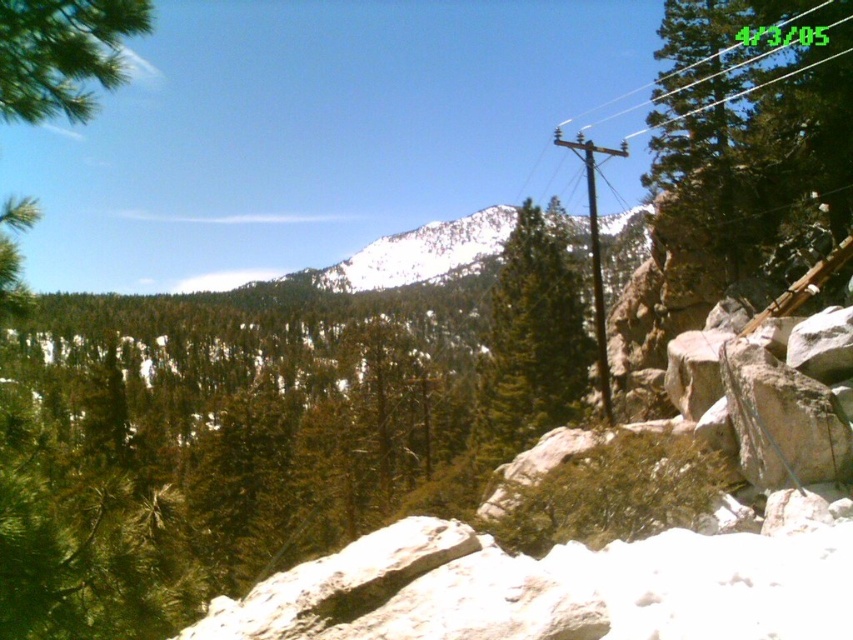
Question: Can you confirm if green textured pine tree at center is positioned below brown wooden telegraph pole at center-right?

Choices:
 (A) no
 (B) yes

Answer: (B)

Question: Does snowy white mountain at center appear on the right side of brown wooden telegraph pole at center-right?

Choices:
 (A) yes
 (B) no

Answer: (B)

Question: Which object is positioned closest to the green textured pine tree at center?

Choices:
 (A) brown wooden telegraph pole at center-right
 (B) black plastic power line at upper right

Answer: (A)

Question: Which object is positioned farthest from the brown wooden telegraph pole at center-right?

Choices:
 (A) green textured pine tree at center
 (B) snowy white mountain at center
 (C) black plastic power line at upper right

Answer: (A)

Question: Which object appears farthest from the camera in this image?

Choices:
 (A) black plastic power line at upper right
 (B) green textured pine tree at center
 (C) brown wooden telegraph pole at center-right

Answer: (C)

Question: Can you confirm if snowy white mountain at center is positioned below black plastic power line at upper right?

Choices:
 (A) no
 (B) yes

Answer: (B)